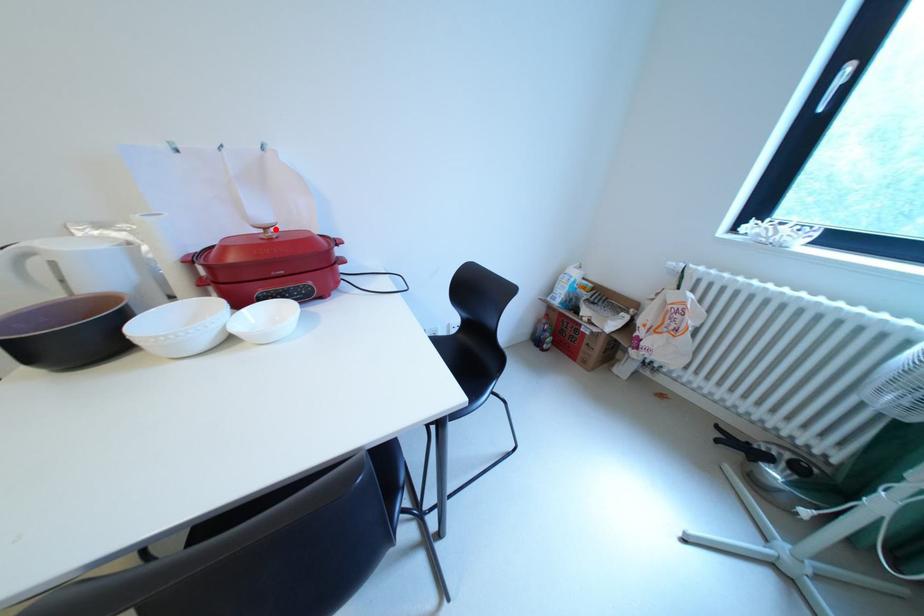
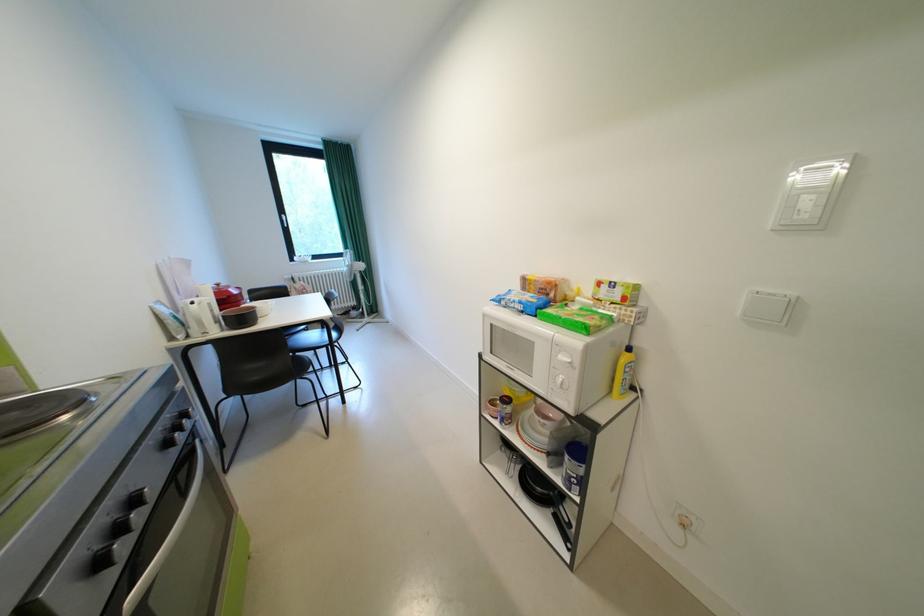
Question: A red point is marked in image1. In image2, is the corresponding 3D point closer to the camera or farther? Reply with the corresponding letter.

Choices:
 (A) The corresponding 3D point is closer.
 (B) The corresponding 3D point is farther.

Answer: (A)